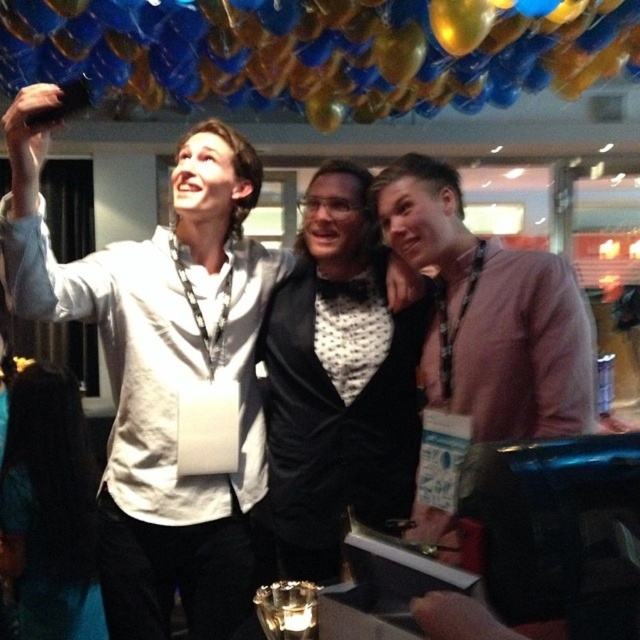
Question: Is blue glossy balloon at upper center smaller than black satin bow tie at center?

Choices:
 (A) no
 (B) yes

Answer: (A)

Question: Among these points, which one is nearest to the camera?

Choices:
 (A) (330, 332)
 (B) (426, 220)

Answer: (B)

Question: Is white matte shirt at upper left above black satin bow tie at center?

Choices:
 (A) no
 (B) yes

Answer: (A)

Question: Estimate the real-world distances between objects in this image. Which object is farther from the pink fabric shirt at right?

Choices:
 (A) white matte shirt at upper left
 (B) black satin bow tie at center

Answer: (A)

Question: Can you confirm if white matte shirt at upper left is bigger than pink fabric shirt at right?

Choices:
 (A) yes
 (B) no

Answer: (A)

Question: Based on their relative distances, which object is nearer to the pink fabric shirt at right?

Choices:
 (A) black satin bow tie at center
 (B) white matte shirt at upper left

Answer: (A)